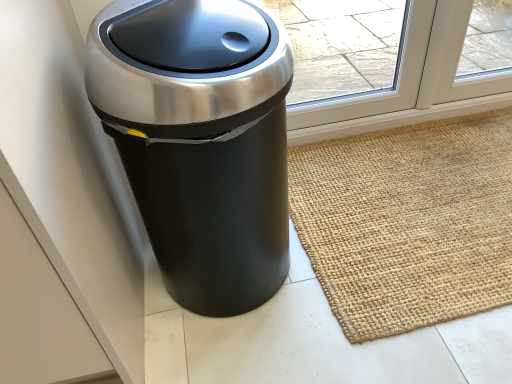
Identify the location of space that is in front of satin black trash can at left. The height and width of the screenshot is (384, 512). (258, 351).